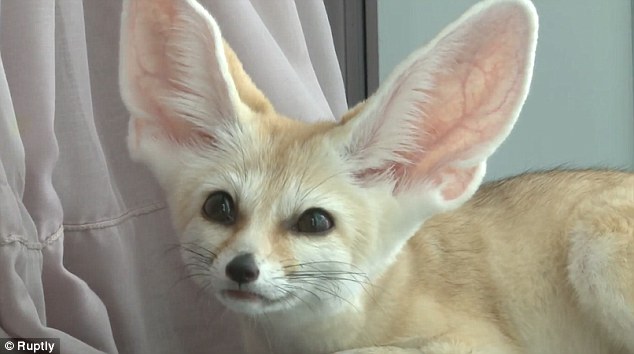
You are a GUI agent. You are given a task and a screenshot of the screen. Output one action in this format:
    pyautogui.click(x=<x>, y=<y>)
    Task: Click on the wall
    Image resolution: width=634 pixels, height=354 pixels.
    Given the screenshot: What is the action you would take?
    pyautogui.click(x=560, y=65)